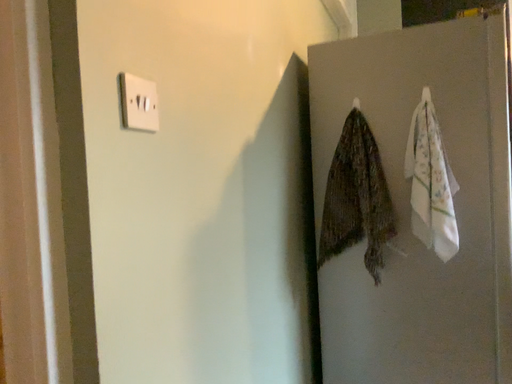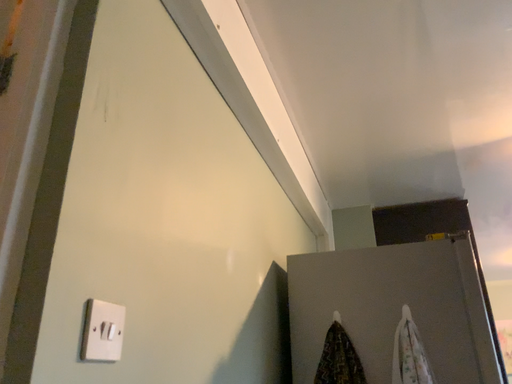
Question: How did the camera likely rotate when shooting the video?

Choices:
 (A) rotated upward
 (B) rotated downward

Answer: (A)